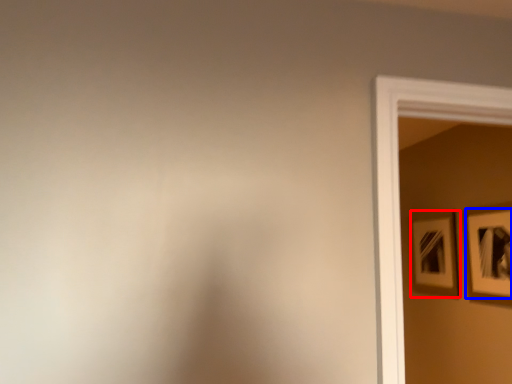
Question: Which point is closer to the camera, picture frame (highlighted by a red box) or picture frame (highlighted by a blue box)?

Choices:
 (A) picture frame
 (B) picture frame

Answer: (B)